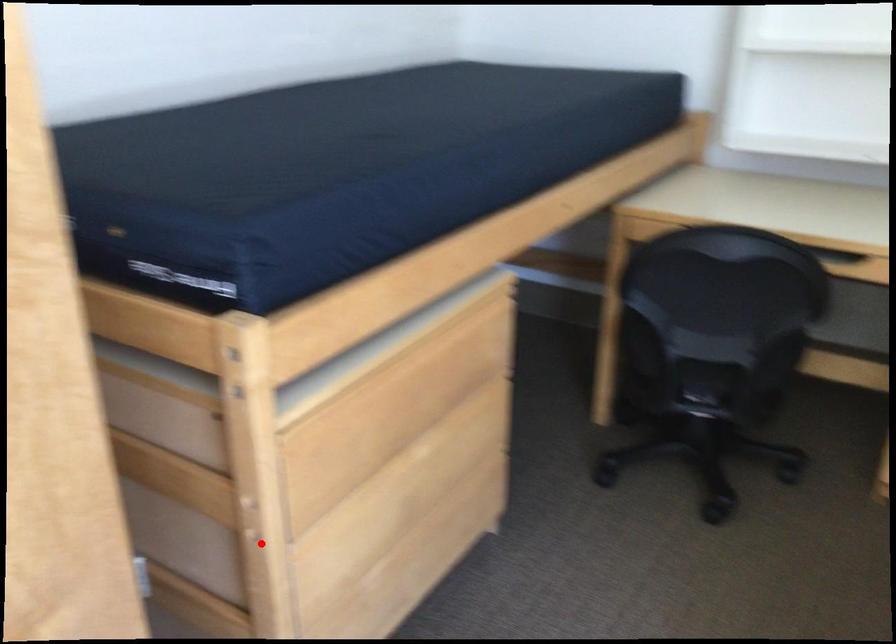
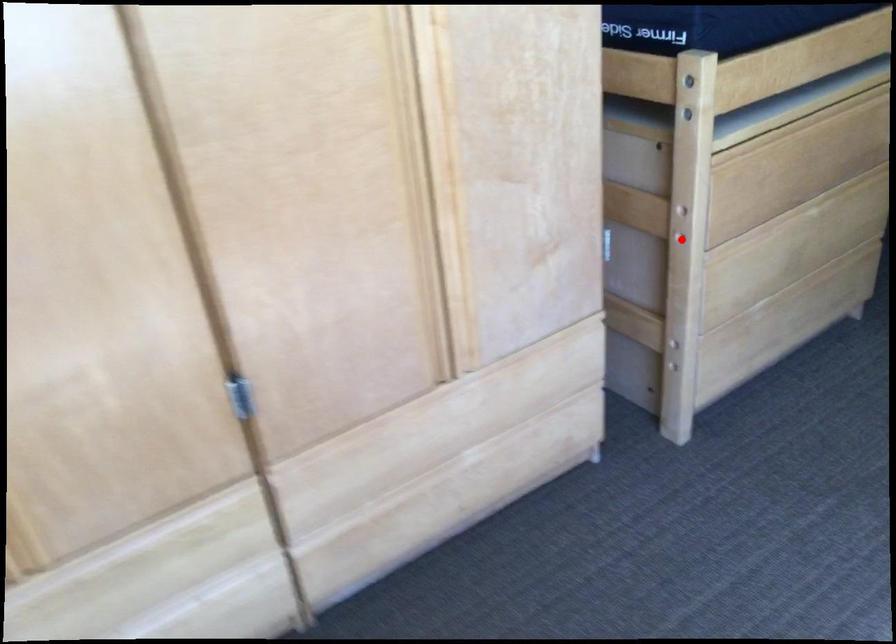
I am providing you with two images of the same scene from different viewpoints. A red point is marked on the first image and another point is marked on the second image. Is the marked point in image1 the same physical position as the marked point in image2?

Yes